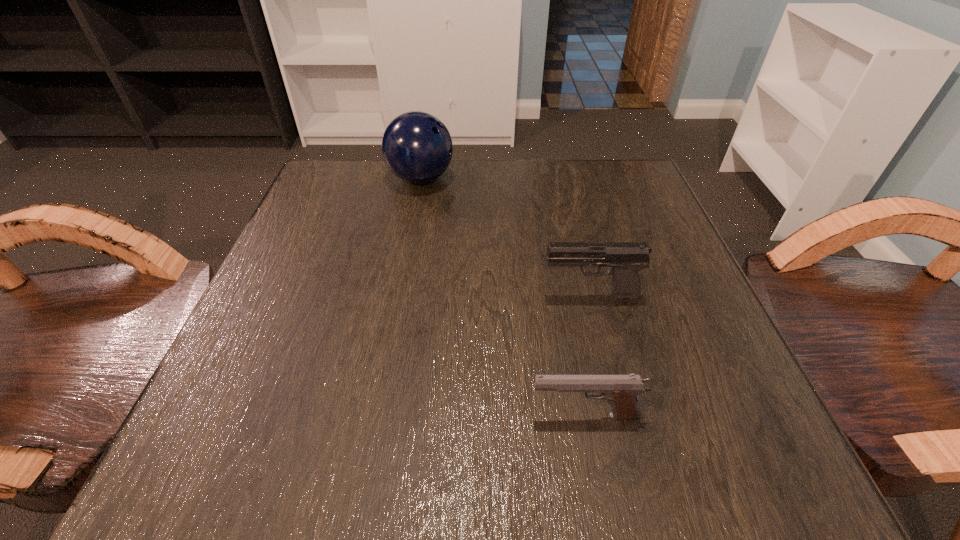
Find the location of a particular element. This screenshot has height=540, width=960. free location located 0.340m at the barrel of the nearer pistol is located at coordinates (272, 415).

This screenshot has height=540, width=960. What are the coordinates of `vacant region located at the barrel of the nearer pistol` in the screenshot? It's located at (386, 415).

Find the location of a particular element. The image size is (960, 540). vacant point located at the barrel of the nearer pistol is located at coordinates (348, 415).

Identify the location of object at the far edge. The image size is (960, 540). (417, 147).

You are a GUI agent. You are given a task and a screenshot of the screen. Output one action in this format:
    pyautogui.click(x=<x>, y=<y>)
    Task: Click on the object that is positioned at the near edge
    The height and width of the screenshot is (540, 960).
    Given the screenshot: What is the action you would take?
    pyautogui.click(x=621, y=391)

The height and width of the screenshot is (540, 960). In order to click on object located in the left edge section of the desktop in this screenshot , I will do `click(417, 147)`.

Locate an element on the screen. object that is positioned at the far left corner is located at coordinates click(x=417, y=147).

Find the location of a particular element. This screenshot has height=540, width=960. object at the near right corner is located at coordinates (621, 391).

Where is `vacant space at the far edge`? The width and height of the screenshot is (960, 540). vacant space at the far edge is located at coordinates (491, 174).

Where is `vacant space at the near edge of the desktop`? vacant space at the near edge of the desktop is located at coordinates (354, 428).